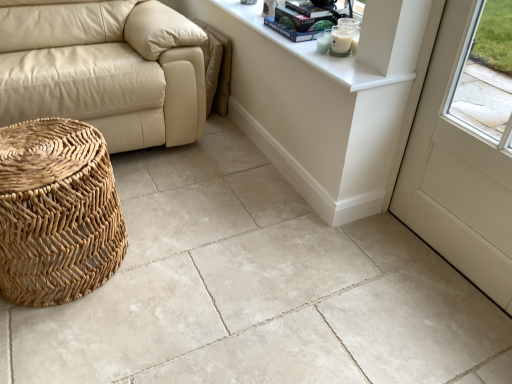
In order to click on free space that is in between natural woven basket at lower left and white matte screen door at lower right in this screenshot , I will do `click(274, 268)`.